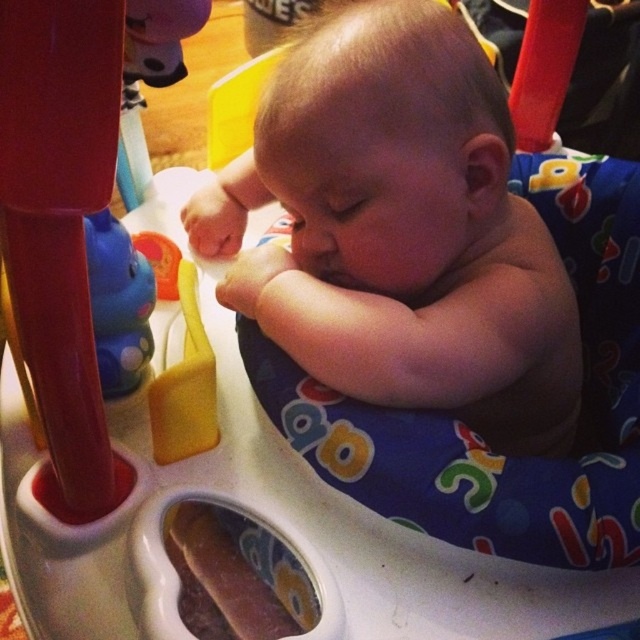
You are a toy designer evaluating the safety of placing the rubberized plastic toy at left near the smooth skin baby at center. Considering their sizes, is there a risk that the baby might accidentally swallow the toy?

The smooth skin baby at center is bigger than the rubberized plastic toy at left. Since the baby is larger, the toy is small enough that the baby could potentially swallow it, posing a choking hazard.

You are a babysitter who needs to place the blue rubber toy at left within reach of the smooth skin baby at center. Considering their heights, can the baby easily reach the toy without stretching too much?

The smooth skin baby at center is taller than the blue rubber toy at left, so the baby can easily reach the toy without stretching too much as they are taller and can comfortably extend their arm.

You are a parent trying to retrieve a toy for your baby. You see the blue rubber toy at left and the rubberized plastic toy at left. Which toy is located lower in the activity center?

The blue rubber toy at left is positioned under the rubberized plastic toy at left, so it is located lower in the activity center.